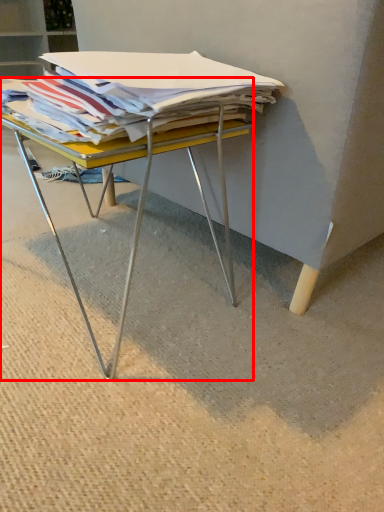
Question: From the image, what is the correct spatial relationship of desk (annotated by the red box) in relation to magazine?

Choices:
 (A) left
 (B) right

Answer: (A)